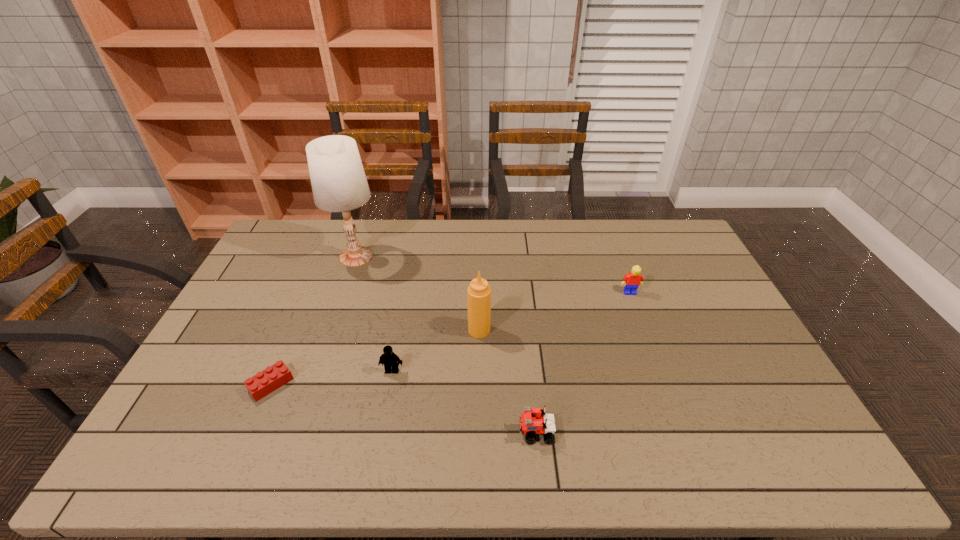
Find the location of `the tallest object`. the tallest object is located at coordinates (339, 184).

What are the coordinates of `lamp` in the screenshot? It's located at coord(339,184).

Locate an element on the screen. Image resolution: width=960 pixels, height=540 pixels. the third farthest object is located at coordinates (478, 292).

Image resolution: width=960 pixels, height=540 pixels. Identify the location of the third object from right to left. pos(478,292).

Locate an element on the screen. Image resolution: width=960 pixels, height=540 pixels. the second farthest object is located at coordinates (633, 279).

You are a GUI agent. You are given a task and a screenshot of the screen. Output one action in this format:
    pyautogui.click(x=<x>, y=<y>)
    Task: Click on the farthest Lego
    This screenshot has height=540, width=960.
    Given the screenshot: What is the action you would take?
    pyautogui.click(x=633, y=279)

Locate an element on the screen. This screenshot has height=540, width=960. the fourth object from right to left is located at coordinates (389, 358).

This screenshot has width=960, height=540. In order to click on the fifth object from left to right in this screenshot , I will do `click(533, 421)`.

You are a GUI agent. You are given a task and a screenshot of the screen. Output one action in this format:
    pyautogui.click(x=<x>, y=<y>)
    Task: Click on the nearest object
    
    Given the screenshot: What is the action you would take?
    pyautogui.click(x=533, y=421)

I want to click on the leftmost Lego, so click(x=273, y=377).